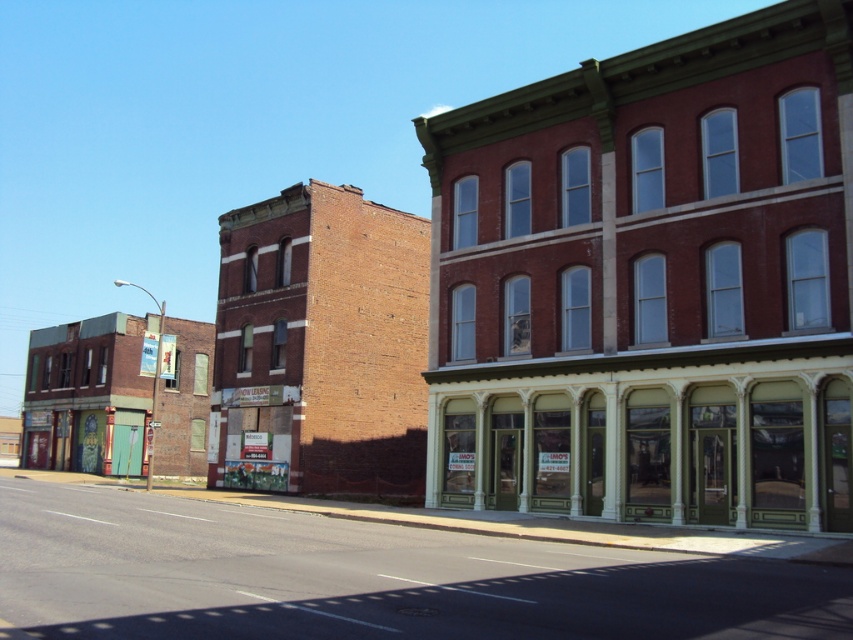
You are a delivery person who needs to park your van between the green painted wood storefront at center and the brick building at left. The van is 20 feet long. Can you park your van between them without overlapping either building?

The distance between the green painted wood storefront at center and the brick building at left is 93.78 feet. Since the van is only 20 feet long, there is sufficient space to park it between them without overlapping either building.

You are a delivery person trying to park your 1.8 meters wide delivery cart between the green painted wood storefront at center and the multicolored painted doors at lower left. Can your cart fit in the space between them?

The green painted wood storefront at center has a lesser width compared to multicolored painted doors at lower left. However, the total combined width of both objects is not provided, so it is unclear if the space between them can accommodate the 1.8 meters wide delivery cart. More information is needed to determine if the cart can fit.

What is the color of the storefront at the point marked by coordinates (653, 435)?

The point marked by coordinates (653, 435) is the green painted wood storefront at center.